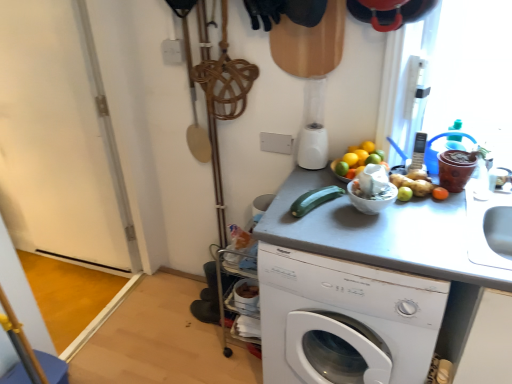
Locate an element on the screen. This screenshot has height=384, width=512. free space to the left of green matte cucumber at center is located at coordinates (281, 213).